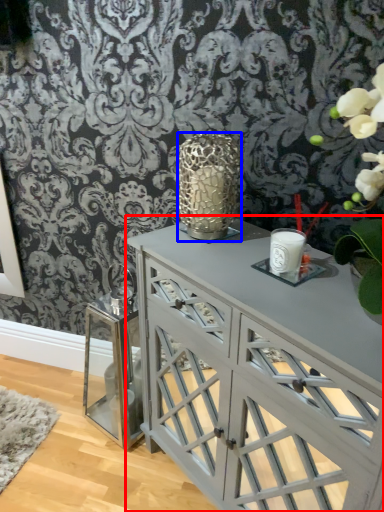
Question: Among these objects, which one is nearest to the camera, table (highlighted by a red box) or candle holder (highlighted by a blue box)?

Choices:
 (A) table
 (B) candle holder

Answer: (A)